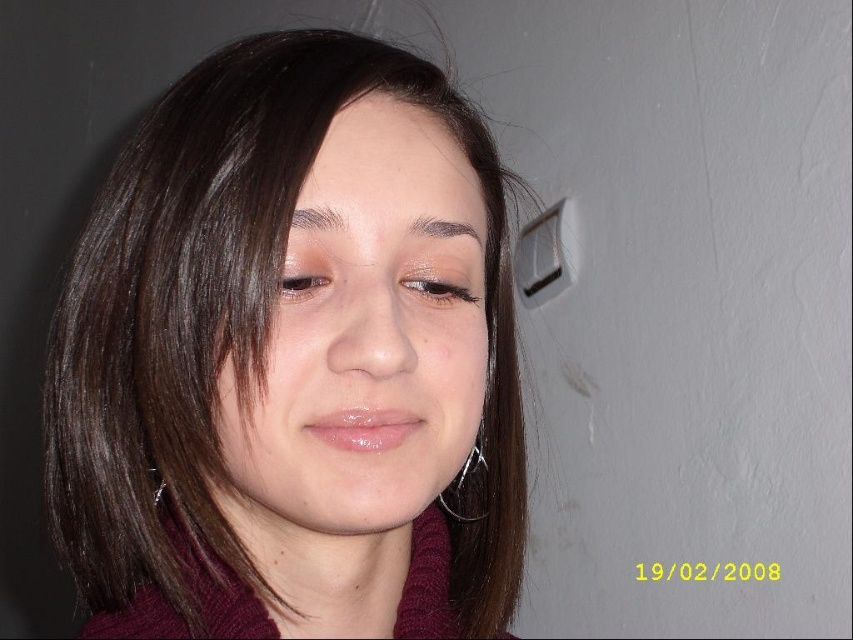
From the picture: Between matte brown eye at center and dark brown hair at upper center, which one has more height?

Standing taller between the two is matte brown eye at center.

Who is more forward, (428, 276) or (294, 209)?

Point (294, 209)

At what (x,y) coordinates should I click in order to perform the action: click on matte brown eye at center. Please return your answer as a coordinate pair (x, y). The height and width of the screenshot is (640, 853). Looking at the image, I should click on (440, 285).

Does brown glossy eye at upper left appear on the right side of dark brown eyebrow at upper center?

Incorrect, brown glossy eye at upper left is not on the right side of dark brown eyebrow at upper center.

Does brown glossy eye at upper left appear on the left side of dark brown eyebrow at upper center?

Indeed, brown glossy eye at upper left is positioned on the left side of dark brown eyebrow at upper center.

Is point (320, 291) positioned after point (418, 220)?

No, it is in front of (418, 220).

This screenshot has height=640, width=853. I want to click on brown glossy eye at upper left, so click(302, 282).

Is brown matte hair at center above dark brown eyebrow at upper center?

No.

Between brown matte hair at center and dark brown eyebrow at upper center, which one appears on the right side from the viewer's perspective?

From the viewer's perspective, dark brown eyebrow at upper center appears more on the right side.

Between point (386, 554) and point (440, 227), which one is positioned in front?

Point (440, 227) is more forward.

Identify the location of brown matte hair at center. The image size is (853, 640). (291, 362).